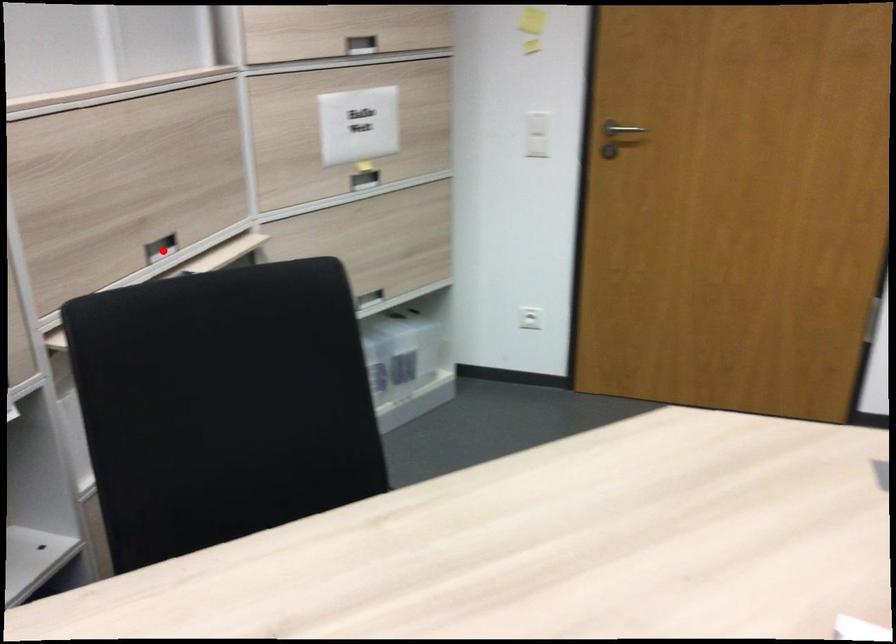
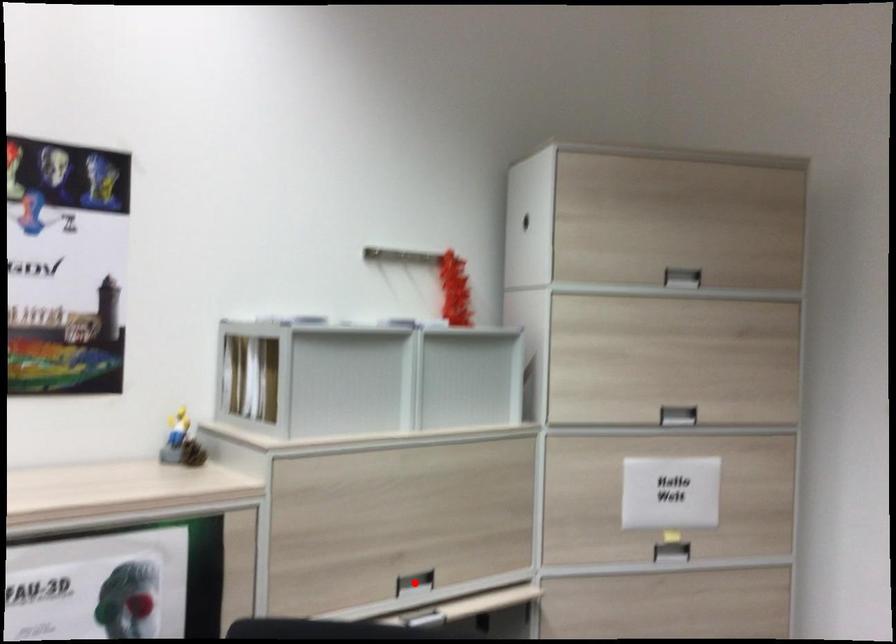
I am providing you with two images of the same scene from different viewpoints. A red point is marked on the first image and another point is marked on the second image. Is the red point in image1 aligned with the point shown in image2?

Yes